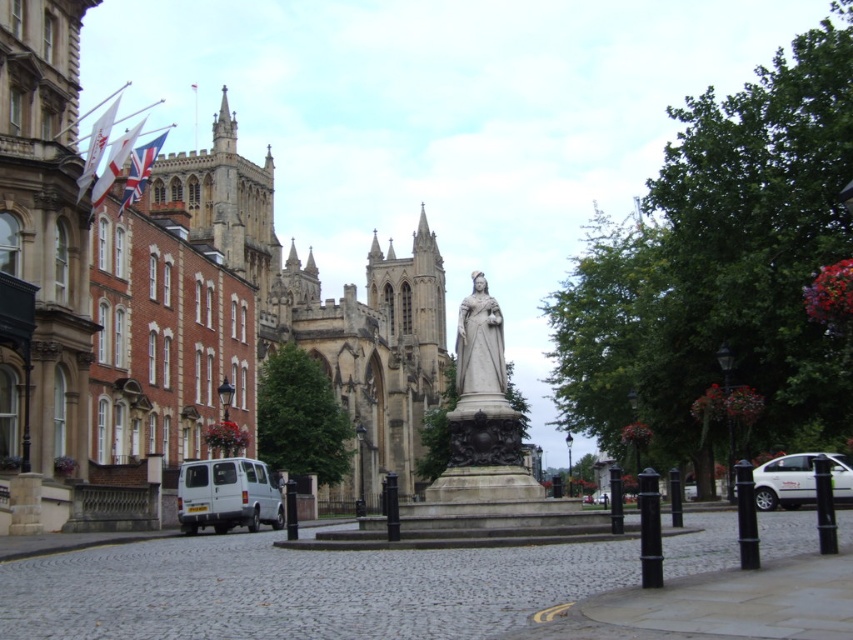
Question: Can you confirm if white matte van at lower left is positioned to the left of white matte car at lower right?

Choices:
 (A) no
 (B) yes

Answer: (B)

Question: Which object appears closest to the camera in this image?

Choices:
 (A) stone gothic church at center
 (B) white matte car at lower right

Answer: (B)

Question: Observing the image, what is the correct spatial positioning of white matte van at lower left in reference to white matte car at lower right?

Choices:
 (A) above
 (B) below

Answer: (B)

Question: From the image, what is the correct spatial relationship of white matte van at lower left in relation to polished bronze statue at center?

Choices:
 (A) below
 (B) above

Answer: (A)

Question: Which object is closer to the camera taking this photo?

Choices:
 (A) polished bronze statue at center
 (B) stone gothic church at center

Answer: (A)

Question: Among these objects, which one is nearest to the camera?

Choices:
 (A) polished bronze statue at center
 (B) stone gothic church at center

Answer: (A)